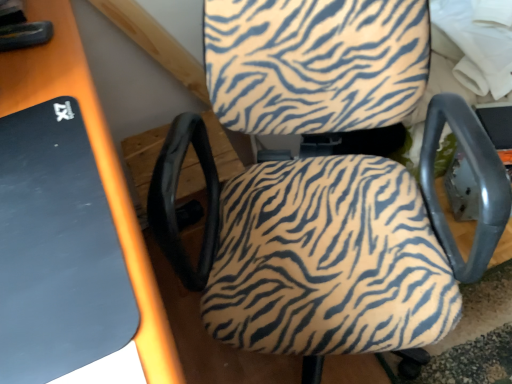
Question: In terms of width, does black matte mousepad at left look wider or thinner when compared to zebra-patterned fabric chair at center?

Choices:
 (A) wide
 (B) thin

Answer: (B)

Question: Based on their positions, is black matte mousepad at left located to the left or right of zebra-patterned fabric chair at center?

Choices:
 (A) left
 (B) right

Answer: (A)

Question: From the image's perspective, is black matte mousepad at left above or below zebra-patterned fabric chair at center?

Choices:
 (A) below
 (B) above

Answer: (A)

Question: Which is correct: zebra-patterned fabric chair at center is inside black matte mousepad at left, or outside of it?

Choices:
 (A) inside
 (B) outside

Answer: (B)

Question: Considering the relative positions of zebra-patterned fabric chair at center and black matte mousepad at left in the image provided, is zebra-patterned fabric chair at center to the left or to the right of black matte mousepad at left?

Choices:
 (A) left
 (B) right

Answer: (B)

Question: Looking at their shapes, would you say zebra-patterned fabric chair at center is wider or thinner than black matte mousepad at left?

Choices:
 (A) wide
 (B) thin

Answer: (A)

Question: In terms of size, does zebra-patterned fabric chair at center appear bigger or smaller than black matte mousepad at left?

Choices:
 (A) big
 (B) small

Answer: (A)